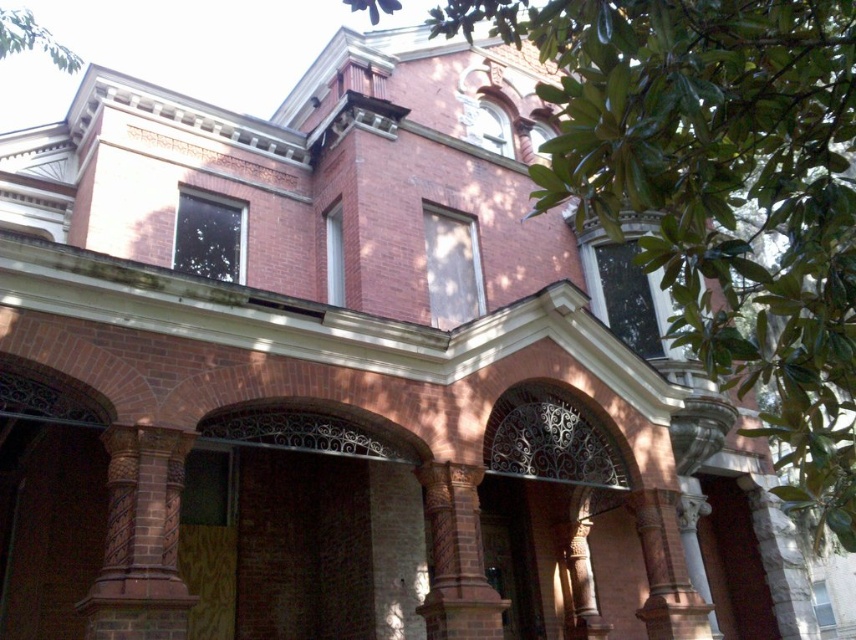
Between brown stone column at center and brown textured column at center, which one appears on the left side from the viewer's perspective?

brown stone column at center is more to the left.

Looking at this image, does brown stone column at center have a lesser width compared to brown textured column at center?

In fact, brown stone column at center might be wider than brown textured column at center.

Which is behind, point (86, 609) or point (450, 563)?

Point (450, 563)

At what (x,y) coordinates should I click in order to perform the action: click on brown stone column at center. Please return your answer as a coordinate pair (x, y). The height and width of the screenshot is (640, 856). Looking at the image, I should click on (140, 540).